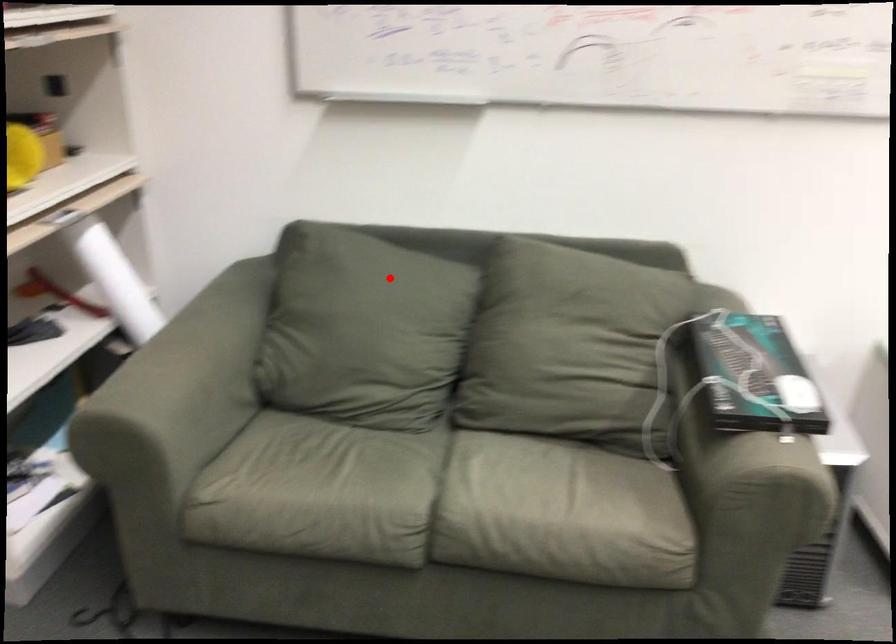
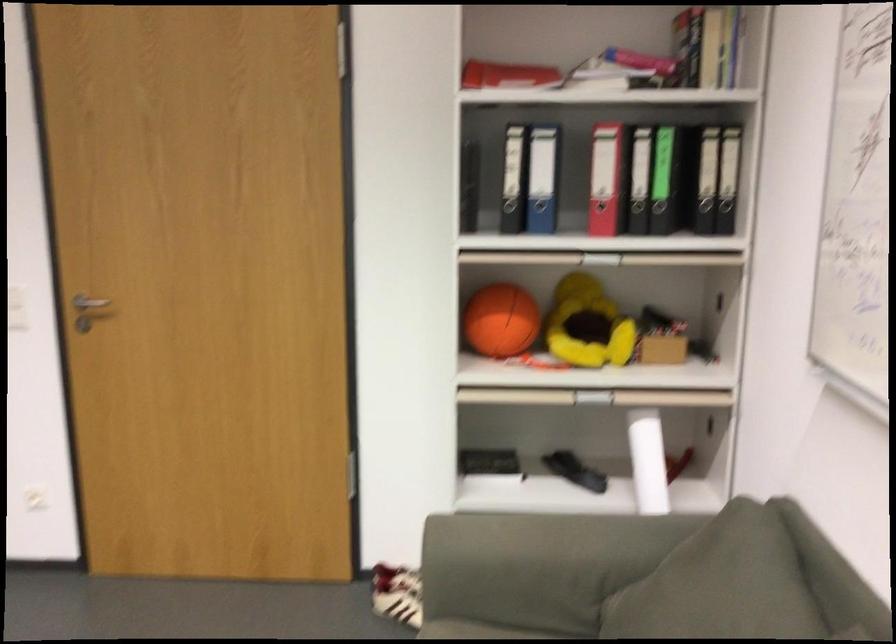
Locate, in the second image, the point that corresponds to the highlighted location in the first image.

(747, 592)